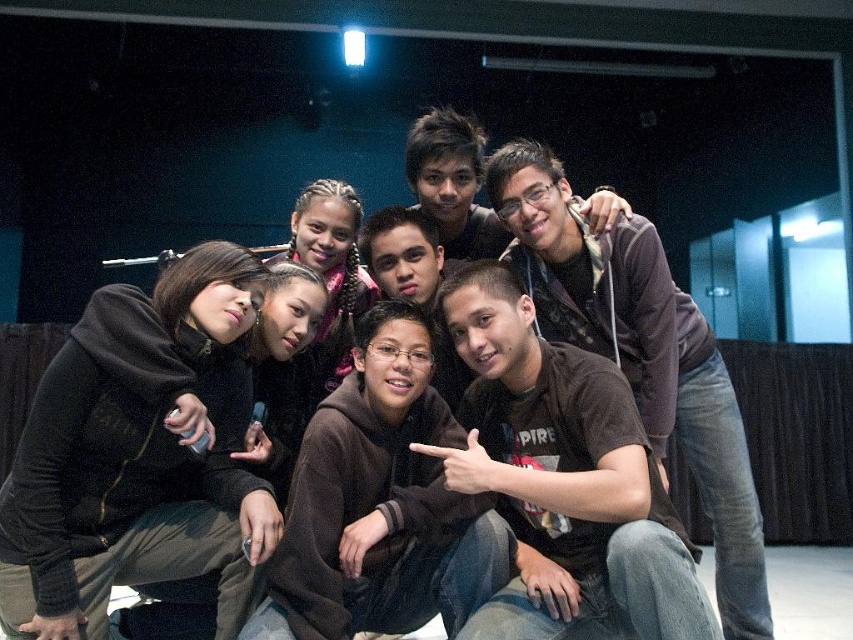
Who is higher up, brown hoodie at center or brown matte shirt at center?

Positioned higher is brown matte shirt at center.

Which is in front, point (326, 579) or point (635, 365)?

Point (326, 579) is in front.

The width and height of the screenshot is (853, 640). Identify the location of brown hoodie at center. (380, 504).

Is dark brown hoodie at lower left to the right of brown hoodie at center from the viewer's perspective?

Incorrect, dark brown hoodie at lower left is not on the right side of brown hoodie at center.

Is dark brown hoodie at lower left smaller than brown hoodie at center?

Actually, dark brown hoodie at lower left might be larger than brown hoodie at center.

This screenshot has height=640, width=853. What do you see at coordinates (136, 454) in the screenshot?
I see `dark brown hoodie at lower left` at bounding box center [136, 454].

At what (x,y) coordinates should I click in order to perform the action: click on dark brown hoodie at lower left. Please return your answer as a coordinate pair (x, y). Looking at the image, I should click on (136, 454).

Is the position of dark brown hoodie at lower left less distant than that of brown matte shirt at center?

Yes.

Is the position of dark brown hoodie at lower left more distant than that of brown matte shirt at center?

No, it is in front of brown matte shirt at center.

The height and width of the screenshot is (640, 853). I want to click on dark brown hoodie at lower left, so click(136, 454).

This screenshot has width=853, height=640. Identify the location of dark brown hoodie at lower left. (136, 454).